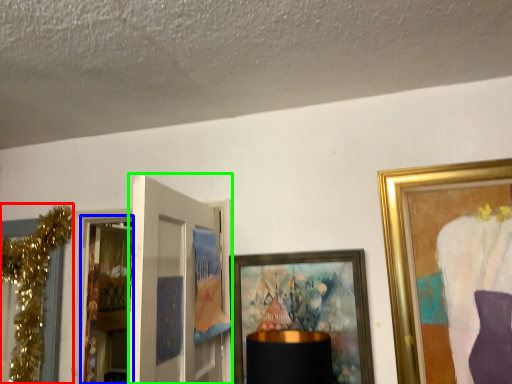
Question: Considering the real-world distances, which object is closest to christmas decoration (highlighted by a red box)? screen door (highlighted by a blue box) or door (highlighted by a green box).

Choices:
 (A) screen door
 (B) door

Answer: (B)